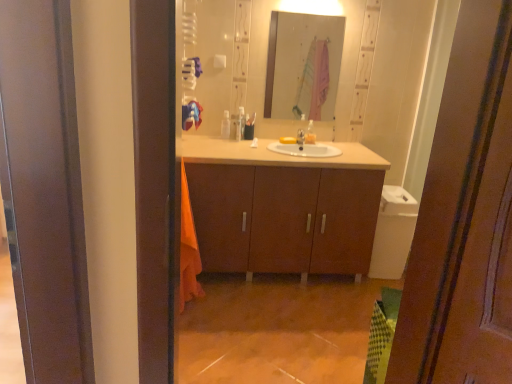
Question: Is silver metallic tap at center at the right side of translucent plastic toothbrush holder at center, positioned as the second toiletry in left-to-right order?

Choices:
 (A) yes
 (B) no

Answer: (A)

Question: Is silver metallic tap at center placed right next to translucent plastic toothbrush holder at center, the second toiletry from the right?

Choices:
 (A) yes
 (B) no

Answer: (B)

Question: Is silver metallic tap at center looking in the opposite direction of translucent plastic toothbrush holder at center, the second toiletry from the right?

Choices:
 (A) no
 (B) yes

Answer: (A)

Question: Can you confirm if silver metallic tap at center is bigger than translucent plastic toothbrush holder at center, positioned as the second toiletry in left-to-right order?

Choices:
 (A) yes
 (B) no

Answer: (B)

Question: Is silver metallic tap at center further to the viewer compared to translucent plastic toothbrush holder at center, the second toiletry from the right?

Choices:
 (A) yes
 (B) no

Answer: (B)

Question: Is silver metallic tap at center facing towards translucent plastic toothbrush holder at center, positioned as the second toiletry in left-to-right order?

Choices:
 (A) no
 (B) yes

Answer: (A)

Question: Is translucent plastic toothbrush holder at center, the second toiletry from the right, bigger than silver metallic tap at center?

Choices:
 (A) no
 (B) yes

Answer: (B)

Question: Is translucent plastic toothbrush holder at center, the second toiletry from the right, in front of silver metallic tap at center?

Choices:
 (A) no
 (B) yes

Answer: (A)

Question: From a real-world perspective, is translucent plastic toothbrush holder at center, positioned as the second toiletry in left-to-right order, physically above silver metallic tap at center?

Choices:
 (A) no
 (B) yes

Answer: (B)

Question: From the image's perspective, does translucent plastic toothbrush holder at center, positioned as the second toiletry in left-to-right order, appear lower than silver metallic tap at center?

Choices:
 (A) yes
 (B) no

Answer: (B)

Question: Can you confirm if translucent plastic toothbrush holder at center, the second toiletry from the right, is positioned to the left of silver metallic tap at center?

Choices:
 (A) no
 (B) yes

Answer: (B)

Question: Is translucent plastic toothbrush holder at center, positioned as the second toiletry in left-to-right order, placed right next to silver metallic tap at center?

Choices:
 (A) yes
 (B) no

Answer: (B)

Question: Is matte wood cabinet at center taller than clear glass mirror at upper center?

Choices:
 (A) no
 (B) yes

Answer: (B)